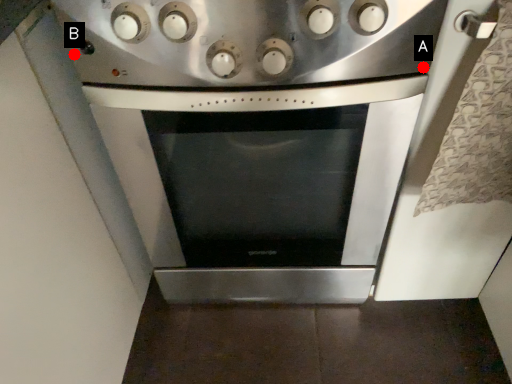
Question: Two points are circled on the image, labeled by A and B beside each circle. Which of the following is the closest to the observer?

Choices:
 (A) A is closer
 (B) B is closer

Answer: (A)